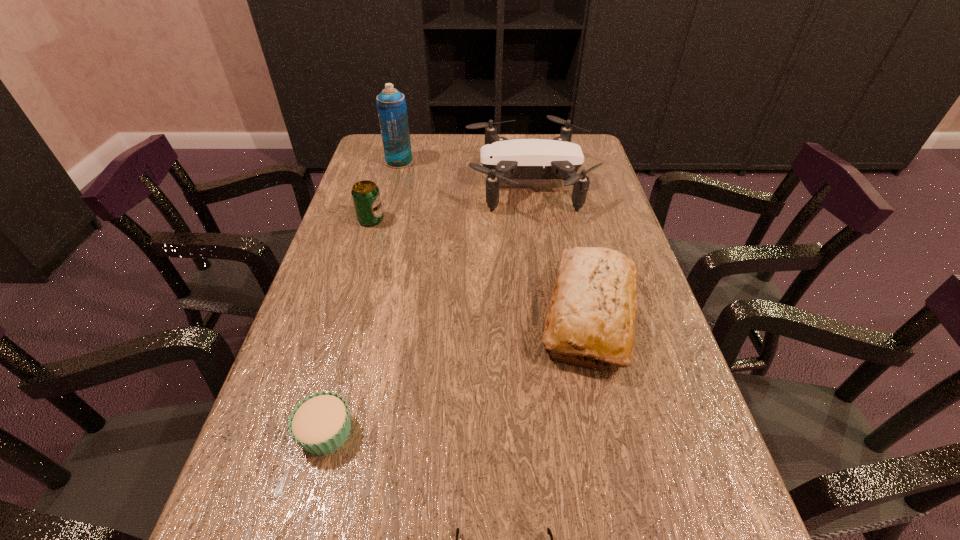
At what (x,y) coordinates should I click in order to perform the action: click on aerosol can. Please return your answer as a coordinate pair (x, y). The width and height of the screenshot is (960, 540). Looking at the image, I should click on (391, 105).

Where is `drone`? Image resolution: width=960 pixels, height=540 pixels. drone is located at coordinates (502, 159).

Find the location of a particular element. Image resolution: width=960 pixels, height=540 pixels. the third nearest object is located at coordinates (593, 306).

At what (x,y) coordinates should I click in order to perform the action: click on beer can. Please return your answer as a coordinate pair (x, y). The image size is (960, 540). Looking at the image, I should click on 366,197.

What are the coordinates of `the fifth farthest object` in the screenshot? It's located at (320, 424).

Find the location of `cupcake`. cupcake is located at coordinates (320, 424).

The height and width of the screenshot is (540, 960). What are the coordinates of `blank area located on the front of the aerosol can` in the screenshot? It's located at (384, 220).

Locate an element on the screen. vacant region located on the camera side of the drone is located at coordinates (417, 183).

This screenshot has width=960, height=540. Find the location of `vacant space situated 0.250m on the camera side of the drone`. vacant space situated 0.250m on the camera side of the drone is located at coordinates (384, 183).

The width and height of the screenshot is (960, 540). Identify the location of vacant space situated on the camera side of the drone. (422, 183).